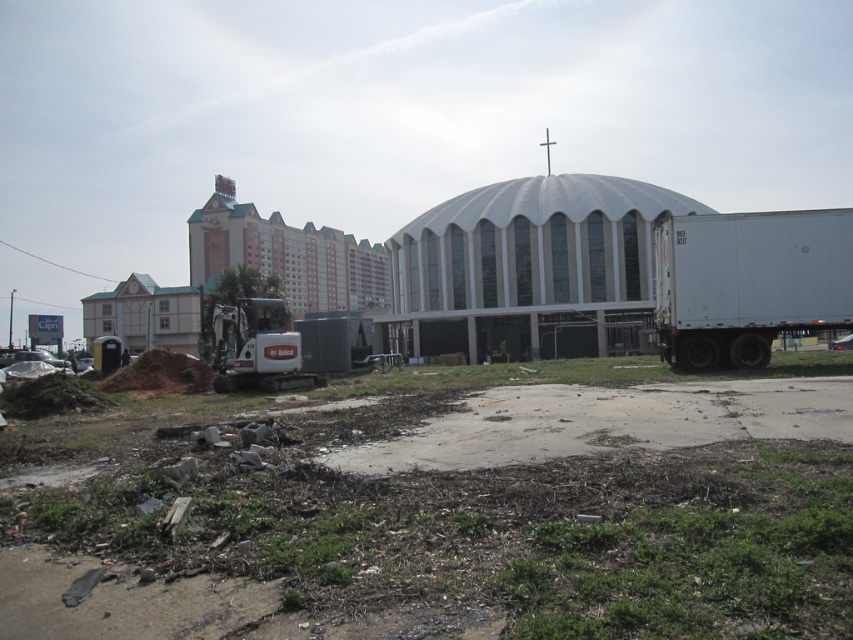
Question: Which point is farther to the camera?

Choices:
 (A) (822, 285)
 (B) (734, 634)

Answer: (A)

Question: Which of the following is the farthest from the observer?

Choices:
 (A) (444, 380)
 (B) (729, 220)

Answer: (A)

Question: Where is dirt at lower left located in relation to white matte trailer truck at right in the image?

Choices:
 (A) above
 (B) below

Answer: (B)

Question: Which of the following is the farthest from the observer?

Choices:
 (A) (756, 365)
 (B) (109, 557)

Answer: (A)

Question: Is dirt at lower left to the left of white matte trailer truck at lower left from the viewer's perspective?

Choices:
 (A) no
 (B) yes

Answer: (A)

Question: Considering the relative positions of dirt at lower left and white matte trailer truck at lower left in the image provided, where is dirt at lower left located with respect to white matte trailer truck at lower left?

Choices:
 (A) right
 (B) left

Answer: (A)